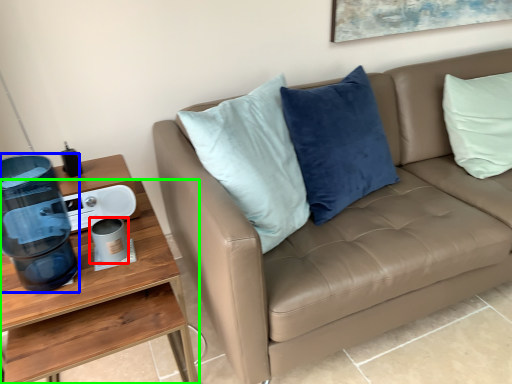
Question: Estimate the real-world distances between objects in this image. Which object is closer to coffee cup (highlighted by a red box), water cooler (highlighted by a blue box) or desk (highlighted by a green box)?

Choices:
 (A) water cooler
 (B) desk

Answer: (B)